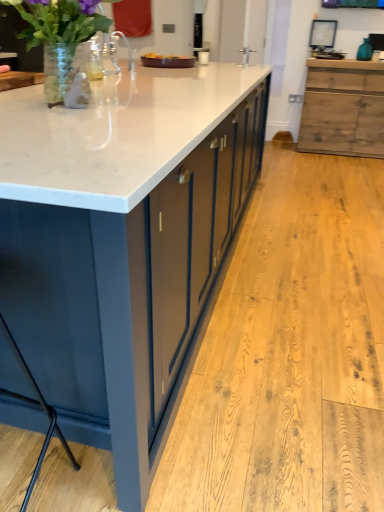
Question: Is matte dark blue bar stool at lower left inside or outside of rustic wood cabinet at right?

Choices:
 (A) outside
 (B) inside

Answer: (A)

Question: From a real-world perspective, is matte dark blue bar stool at lower left positioned above or below rustic wood cabinet at right?

Choices:
 (A) above
 (B) below

Answer: (B)

Question: Considering the real-world distances, which object is farthest from the clear glass vase at upper left?

Choices:
 (A) white marble countertop at center
 (B) rustic wood cabinet at right
 (C) matte dark blue bar stool at lower left

Answer: (B)

Question: Which object is positioned farthest from the matte dark blue bar stool at lower left?

Choices:
 (A) clear glass vase at upper left
 (B) rustic wood cabinet at right
 (C) white marble countertop at center

Answer: (B)